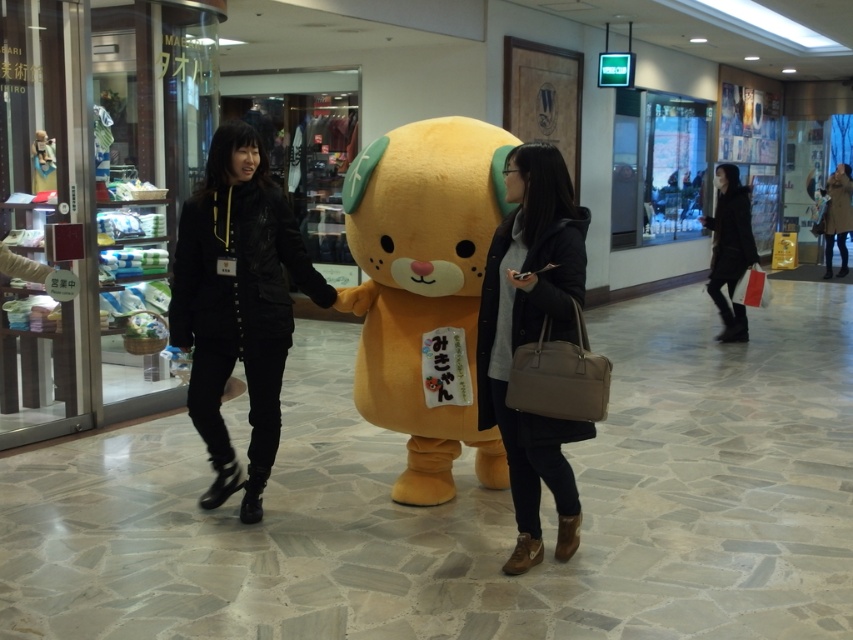
You are a store employee who needs to place the black matte coat at right on a hanger. The hanger is currently occupied by the soft plush teddy bear at center. Can you remove the teddy bear to make space?

The soft plush teddy bear at center is larger in size than the black matte coat at right, so removing the teddy bear would be necessary to free up space for the coat.

You are a customer in the mall and want to take a photo with the mascot. You are currently standing at point (566, 260). If you move straight towards point (485, 218), will you be facing away from the mascot?

Point (485, 218) is behind point (566, 260), so moving straight towards it would mean you are facing away from the mascot.